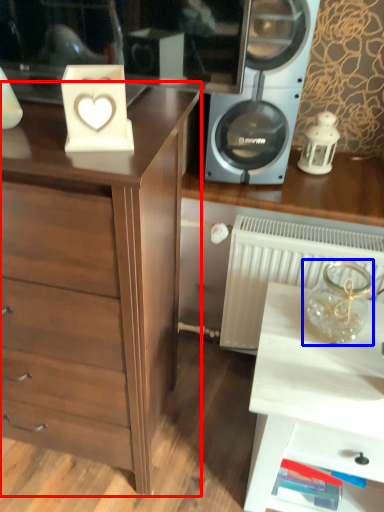
Question: Which object is closer to the camera taking this photo, chest of drawers (highlighted by a red box) or glass vase (highlighted by a blue box)?

Choices:
 (A) chest of drawers
 (B) glass vase

Answer: (A)